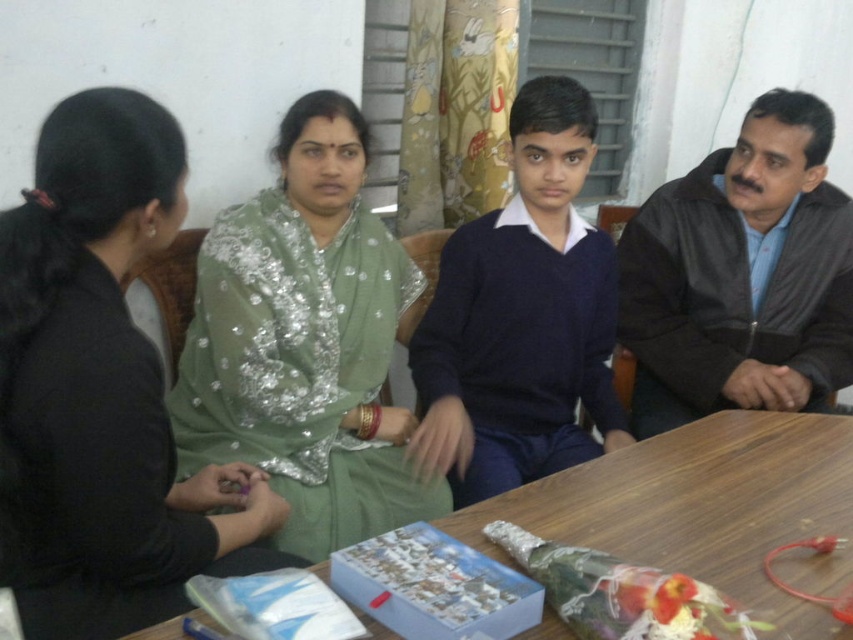
What is the size relationship between the two women wearing the matte green saree at center and the dark blue sweater at center?

The matte green saree at center has a smaller size compared to the dark blue sweater at center.

You are a photographer standing at the camera position. You want to take a closeup shot of the green sequined shawl at center. What is the minimum distance you need to move forward to get the shawl into focus?

The green sequined shawl at center is 1.43 meters away from the camera. To take a closeup shot, you need to move forward until the distance is within your camera lens focusing range. However, without knowing the minimum focusing distance of your lens, it is impossible to determine the exact distance to move.